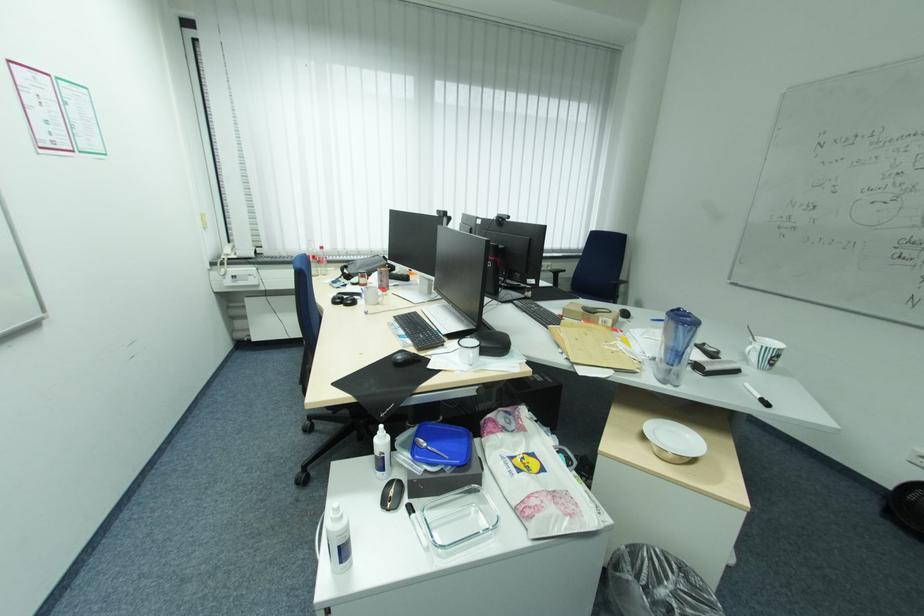
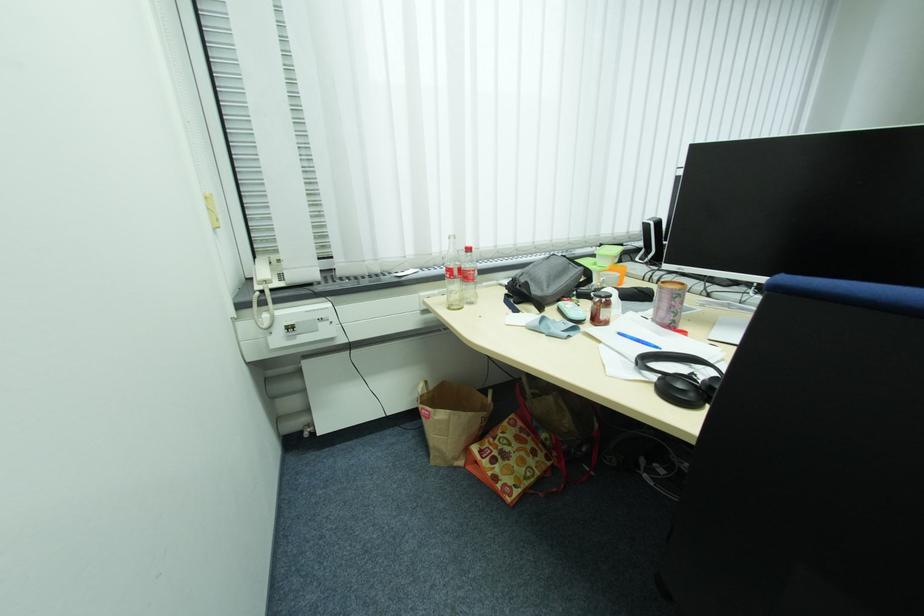
The images are taken continuously from a first-person perspective. In which direction are you moving?

The cameraman moved toward left, forward.